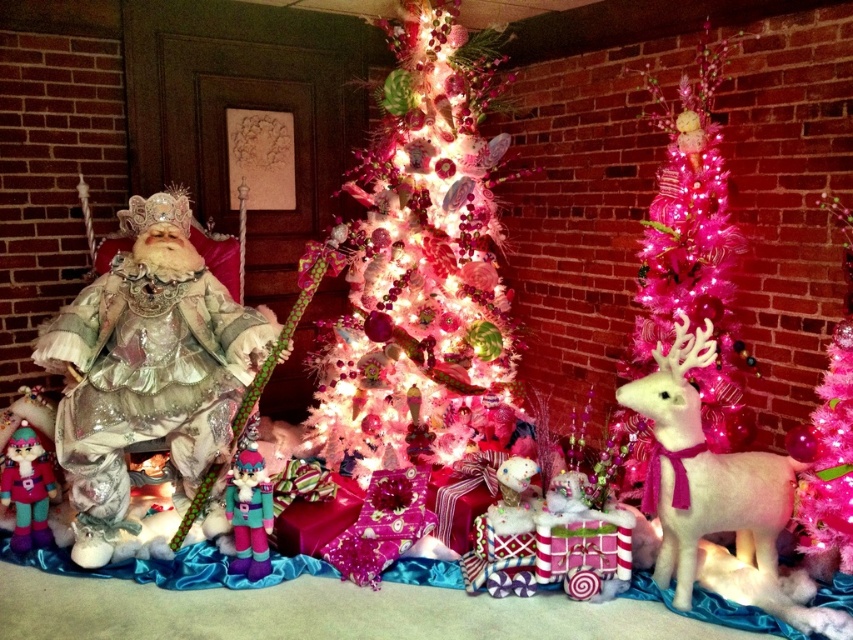
Who is shorter, white glittery christmas tree at center or pink glittery christmas tree at right?

pink glittery christmas tree at right is shorter.

Is point (412, 3) positioned behind point (831, 461)?

Yes, point (412, 3) is farther from viewer.

Is point (485, 259) positioned before point (840, 403)?

That is False.

At what (x,y) coordinates should I click in order to perform the action: click on white glittery christmas tree at center. Please return your answer as a coordinate pair (x, y). The image size is (853, 640). Looking at the image, I should click on click(422, 266).

Does shiny silver doll at left have a lesser width compared to knitted teal and pink elf at center?

Incorrect, shiny silver doll at left's width is not less than knitted teal and pink elf at center's.

Can you confirm if shiny silver doll at left is positioned below knitted teal and pink elf at center?

No.

Is point (206, 518) positioned in front of point (238, 547)?

No.

At what (x,y) coordinates should I click in order to perform the action: click on shiny silver doll at left. Please return your answer as a coordinate pair (x, y). Image resolution: width=853 pixels, height=640 pixels. Looking at the image, I should click on (148, 372).

Who is more forward, (701, 392) or (775, 484)?

Point (775, 484) is more forward.

The height and width of the screenshot is (640, 853). What are the coordinates of `pink tinsel christmas tree at right` in the screenshot? It's located at (692, 250).